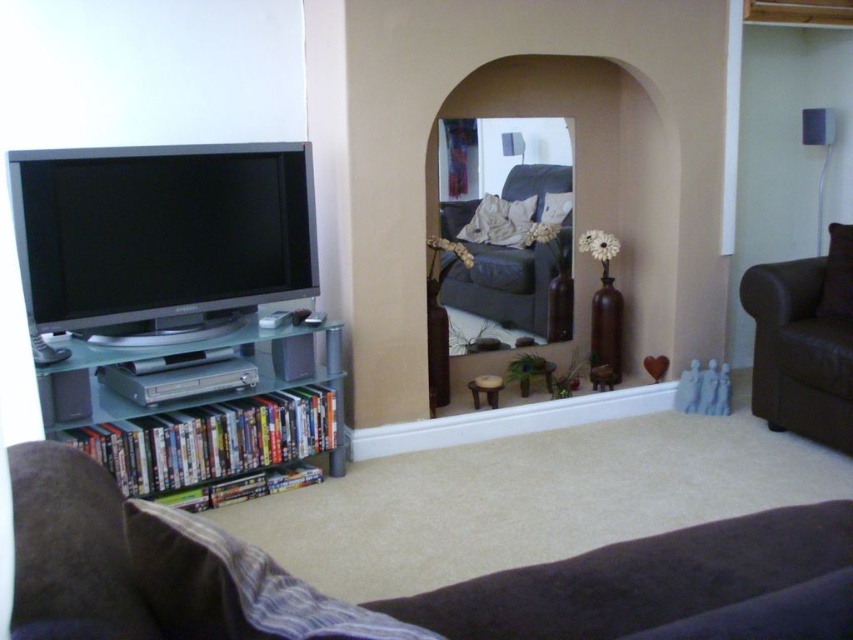
Question: Does suede couch at lower left come in front of brown leather armchair at right?

Choices:
 (A) yes
 (B) no

Answer: (A)

Question: Which point is closer to the camera taking this photo?

Choices:
 (A) (166, 476)
 (B) (102, 474)

Answer: (B)

Question: Can you confirm if suede couch at lower left is wider than clear plastic bookshelf at left?

Choices:
 (A) yes
 (B) no

Answer: (A)

Question: Which object is closer to the camera taking this photo?

Choices:
 (A) leather couch at center
 (B) clear glass entertainment center at left

Answer: (B)

Question: Does suede couch at lower left have a lesser width compared to brown leather armchair at right?

Choices:
 (A) no
 (B) yes

Answer: (A)

Question: Estimate the real-world distances between objects in this image. Which object is closer to the leather couch at center?

Choices:
 (A) clear plastic bookshelf at left
 (B) suede couch at lower left
 (C) clear glass entertainment center at left
 (D) brown leather armchair at right

Answer: (D)